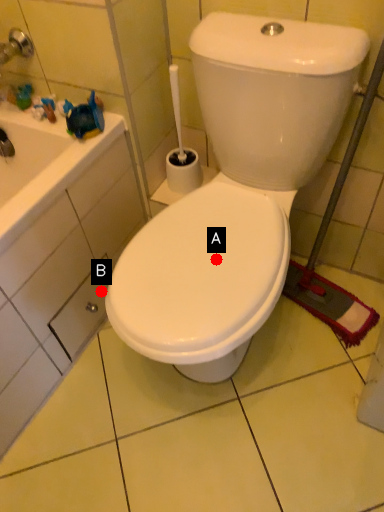
Question: Two points are circled on the image, labeled by A and B beside each circle. Which point is closer to the camera?

Choices:
 (A) A is closer
 (B) B is closer

Answer: (A)